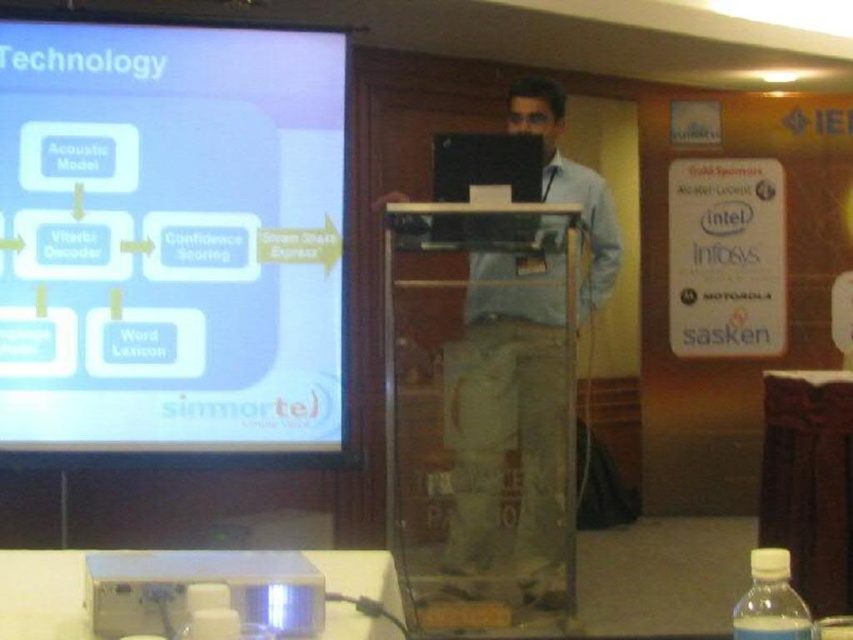
You are attending a presentation and want to know if the point at coordinates point (289, 328) is nearer to you compared to point (747, 588). Based on the scene, can you determine which point is closer?

Yes, according to the scene description, point (289, 328) is closer to the camera than point (747, 588). Since you are observing from the camera perspective, point (289, 328) is nearer to you.

You are organizing a presentation and need to place a new laptop on the table. The existing matte black laptop at center is already placed at coordinates 0.583, 0.614. If you want to place a new laptop 10 cm to the right and 5 cm above the existing one, where would its coordinates be?

The new laptop would be placed at coordinates 0.583 plus 0.010 equals 0.593 in the x direction and 0.614 minus 0.005 equals 0.609 in the y direction. So the coordinates are approximately [519,379].

You are standing at the point labeled as point [546,348]. The projection screen is 10.46 feet away from you. If you walk straight towards the screen, will you pass through the podium first before reaching the screen?

Yes, because the podium is between you and the screen, so you must pass through it first before reaching the screen.